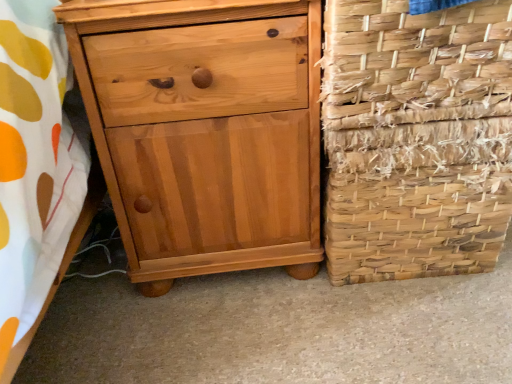
Measure the distance between light brown wood chest of drawers at left and camera.

25.05 inches.

At what (x,y) coordinates should I click in order to perform the action: click on woven straw basket at right. Please return your answer as a coordinate pair (x, y). This screenshot has height=384, width=512. Looking at the image, I should click on (415, 63).

Considering the positions of objects woven natural fiber basket at right and woven straw basket at right in the image provided, who is in front, woven natural fiber basket at right or woven straw basket at right?

woven straw basket at right is in front.

Locate an element on the screen. The height and width of the screenshot is (384, 512). basket container below the woven straw basket at right (from the image's perspective) is located at coordinates (416, 138).

Which object is wider, woven natural fiber basket at right or woven straw basket at right?

→ woven straw basket at right.

Considering the sizes of objects woven natural fiber basket at right and woven straw basket at right in the image provided, who is taller, woven natural fiber basket at right or woven straw basket at right?

woven natural fiber basket at right.

Would you say woven straw basket at right is outside woven natural fiber basket at right?

Yes, woven straw basket at right is outside of woven natural fiber basket at right.

Can you confirm if woven straw basket at right is bigger than woven natural fiber basket at right?

No, woven straw basket at right is not bigger than woven natural fiber basket at right.

Based on the photo, which point is more forward, (438,90) or (413,150)?

The point (438,90) is more forward.

Looking at this image, considering the relative sizes of woven straw basket at right and woven natural fiber basket at right in the image provided, is woven straw basket at right taller than woven natural fiber basket at right?

Incorrect, the height of woven straw basket at right is not larger of that of woven natural fiber basket at right.

Between woven natural fiber basket at right and light brown wood chest of drawers at left, which one has less height?

Standing shorter between the two is woven natural fiber basket at right.

Considering the positions of objects woven natural fiber basket at right and light brown wood chest of drawers at left in the image provided, who is more to the right, woven natural fiber basket at right or light brown wood chest of drawers at left?

Positioned to the right is woven natural fiber basket at right.

At what (x,y) coordinates should I click in order to perform the action: click on basket container on the right of light brown wood chest of drawers at left. Please return your answer as a coordinate pair (x, y). The image size is (512, 384). Looking at the image, I should click on (416, 138).

Is woven natural fiber basket at right facing away from light brown wood chest of drawers at left?

No, woven natural fiber basket at right is not facing away from light brown wood chest of drawers at left.

In the image, is light brown wood chest of drawers at left on the left side or the right side of woven straw basket at right?

light brown wood chest of drawers at left is to the left of woven straw basket at right.

From the picture: From a real-world perspective, is light brown wood chest of drawers at left physically above woven straw basket at right?

No, from a real-world perspective, light brown wood chest of drawers at left is not on top of woven straw basket at right.

Are light brown wood chest of drawers at left and woven straw basket at right beside each other?

No, light brown wood chest of drawers at left is not touching woven straw basket at right.

Identify the location of basket to the right of light brown wood chest of drawers at left. (415, 63).

Consider the image. Is woven straw basket at right touching light brown wood chest of drawers at left?

No, woven straw basket at right is not with light brown wood chest of drawers at left.

Is point (439, 55) in front of point (263, 211)?

Yes, point (439, 55) is in front of point (263, 211).

I want to click on basket above the light brown wood chest of drawers at left (from a real-world perspective), so click(415, 63).

Does point (200, 104) come in front of point (350, 265)?

Yes, it is.

Between light brown wood chest of drawers at left and woven natural fiber basket at right, which one has smaller size?

With smaller size is woven natural fiber basket at right.

Is woven natural fiber basket at right located within light brown wood chest of drawers at left?

No, woven natural fiber basket at right is not surrounded by light brown wood chest of drawers at left.

Consider the image. Considering the positions of objects light brown wood chest of drawers at left and woven natural fiber basket at right in the image provided, who is more to the right, light brown wood chest of drawers at left or woven natural fiber basket at right?

From the viewer's perspective, woven natural fiber basket at right appears more on the right side.

Locate an element on the screen. The height and width of the screenshot is (384, 512). basket container on the right of woven straw basket at right is located at coordinates (416, 138).

Locate an element on the screen. This screenshot has width=512, height=384. basket container behind the woven straw basket at right is located at coordinates (416, 138).

Estimate the real-world distances between objects in this image. Which object is closer to woven straw basket at right, light brown wood chest of drawers at left or woven natural fiber basket at right?

Based on the image, woven natural fiber basket at right appears to be nearer to woven straw basket at right.

Looking at the image, which one is located closer to woven natural fiber basket at right, woven straw basket at right or light brown wood chest of drawers at left?

Based on the image, woven straw basket at right appears to be nearer to woven natural fiber basket at right.

Estimate the real-world distances between objects in this image. Which object is further from light brown wood chest of drawers at left, woven straw basket at right or woven natural fiber basket at right?

Based on the image, woven straw basket at right appears to be further to light brown wood chest of drawers at left.

From the image, which object appears to be nearer to woven natural fiber basket at right, light brown wood chest of drawers at left or woven straw basket at right?

woven straw basket at right lies closer to woven natural fiber basket at right than the other object.

Looking at the image, which one is located closer to woven straw basket at right, woven natural fiber basket at right or light brown wood chest of drawers at left?

woven natural fiber basket at right is closer to woven straw basket at right.

When comparing their distances from light brown wood chest of drawers at left, does woven natural fiber basket at right or woven straw basket at right seem closer?

Among the two, woven natural fiber basket at right is located nearer to light brown wood chest of drawers at left.

Identify the location of basket between light brown wood chest of drawers at left and woven natural fiber basket at right in the horizontal direction. This screenshot has height=384, width=512. pos(415,63).